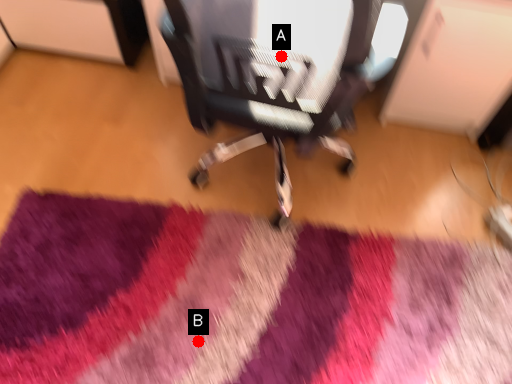
Question: Two points are circled on the image, labeled by A and B beside each circle. Which point is closer to the camera?

Choices:
 (A) A is closer
 (B) B is closer

Answer: (A)